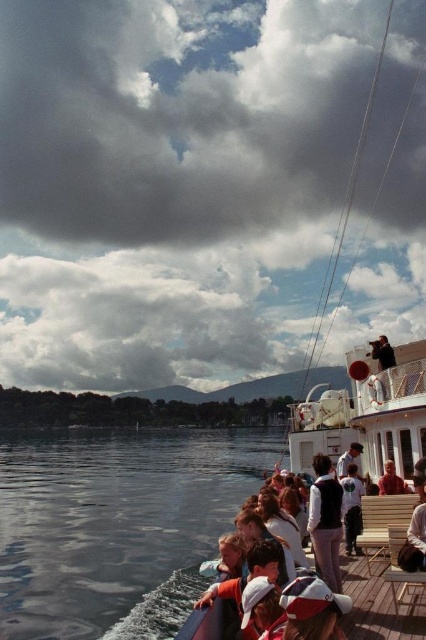
You are planning to jump into the water from the wooden deck at center. Can you safely land in the clear water at lower left?

The clear water at lower left might be wider than wooden deck at center, so it is possible to safely jump into the clear water at lower left from the wooden deck at center.

Looking at this image, you are standing on the wooden deck at center and want to move to the wooden deck boat at center. Which direction should you move to reach it?

The wooden deck boat at center is above the wooden deck at center, so you should move upward to reach it.

You are standing on the boat deck and want to take a photo of the point at coordinates (373, 566). The camera you have can focus up to 50 meters. Will the camera be able to focus on the point?

The point at coordinates (373, 566) is 54.85 meters away from the camera, which exceeds the camera maximum focus distance of 50 meters. Therefore, the camera will not be able to focus on the point.